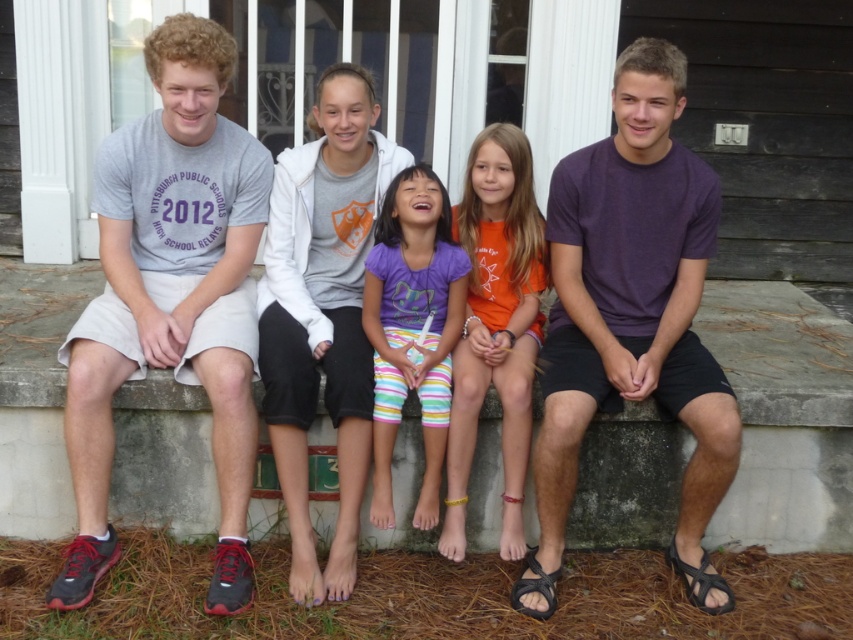
This screenshot has height=640, width=853. What do you see at coordinates (171, 296) in the screenshot?
I see `gray cotton t-shirt at left` at bounding box center [171, 296].

Does gray cotton t-shirt at left have a larger size compared to orange cotton shirt at center?

Correct, gray cotton t-shirt at left is larger in size than orange cotton shirt at center.

The height and width of the screenshot is (640, 853). Identify the location of gray cotton t-shirt at left. (171, 296).

Identify the location of gray cotton t-shirt at left. The height and width of the screenshot is (640, 853). (171, 296).

Locate an element on the screen. purple cotton shirt at right is located at coordinates (631, 316).

Can you confirm if purple cotton shirt at right is taller than purple cotton shirt at center?

Answer: Yes.

Does point (657, 150) lie in front of point (432, 376)?

Yes.

Identify the location of purple cotton shirt at right. This screenshot has height=640, width=853. (631, 316).

Can you confirm if purple cotton shirt at right is bigger than orange cotton shirt at center?

Yes.

How far apart are purple cotton shirt at right and orange cotton shirt at center?

A distance of 11.79 inches exists between purple cotton shirt at right and orange cotton shirt at center.

Image resolution: width=853 pixels, height=640 pixels. Identify the location of purple cotton shirt at right. (631, 316).